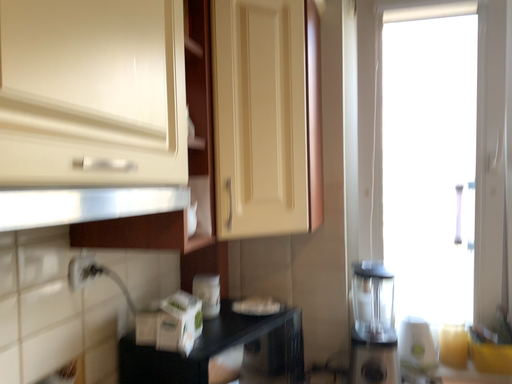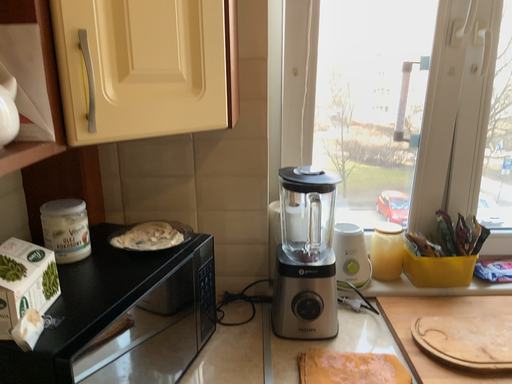
Question: Which way did the camera rotate in the video?

Choices:
 (A) rotated left
 (B) rotated right

Answer: (B)